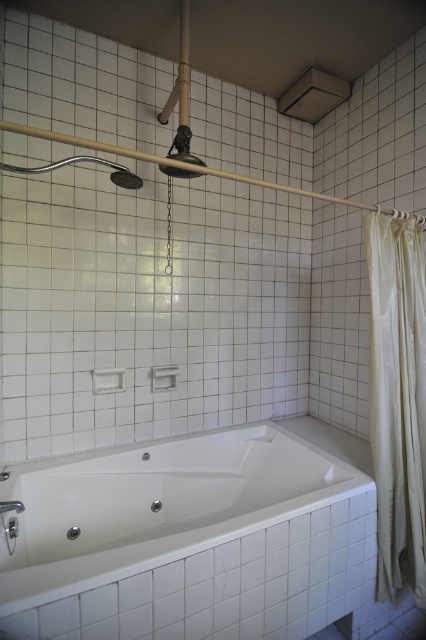
You are a contractor measuring bathroom fixtures. You need to install a new showerhead that must be wider than the existing one. The existing one is the polished chrome showerhead at upper center. Can the new showerhead be wider than the white plastic towel bar at center?

The polished chrome showerhead at upper center might be wider than the white plastic towel bar at center, so the new showerhead cannot be wider than the existing one if it needs to stay narrower than the towel bar.

You are standing in the bathroom and want to locate the white glossy bathtub at lower center. According to the coordinates given, where would you find it?

The white glossy bathtub at lower center is located at coordinates point (189, 540).

You are standing in the bathroom and need to reach both the polished chrome showerhead at upper center and the white plastic towel bar at center. Which one is located to the left?

The polished chrome showerhead at upper center is to the left of the white plastic towel bar at center.